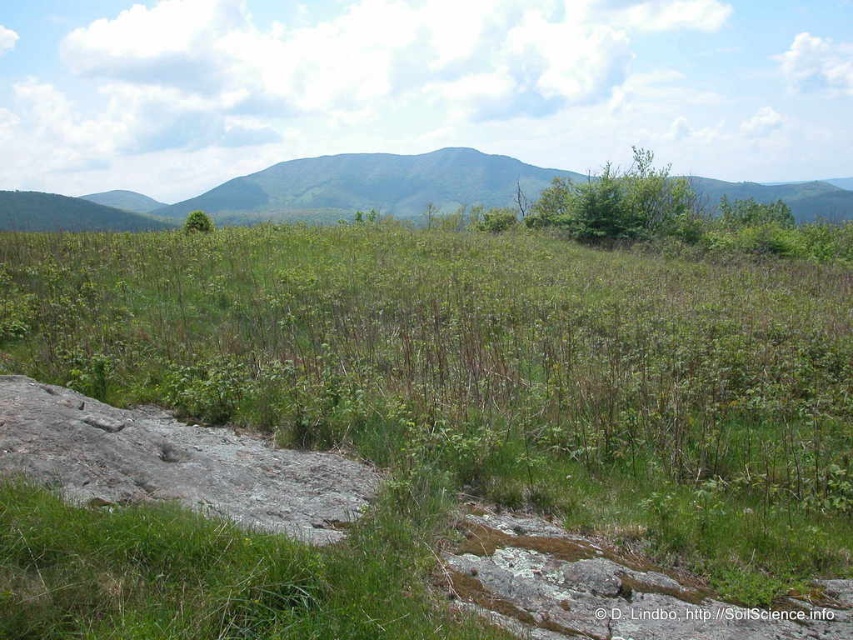
Question: Which object appears farthest from the camera in this image?

Choices:
 (A) gray rough rock at lower left
 (B) green grassy at center

Answer: (A)

Question: Which point is farther from the camera taking this photo?

Choices:
 (A) (334, 369)
 (B) (274, 512)

Answer: (A)

Question: Can you confirm if green grassy at center is smaller than gray rough rock at lower left?

Choices:
 (A) no
 (B) yes

Answer: (A)

Question: Considering the relative positions of green grassy at center and gray rough rock at lower left in the image provided, where is green grassy at center located with respect to gray rough rock at lower left?

Choices:
 (A) right
 (B) left

Answer: (A)

Question: Does green grassy at center appear under gray rough rock at lower left?

Choices:
 (A) no
 (B) yes

Answer: (A)

Question: Which point is closer to the camera taking this photo?

Choices:
 (A) (625, 289)
 (B) (198, 440)

Answer: (B)